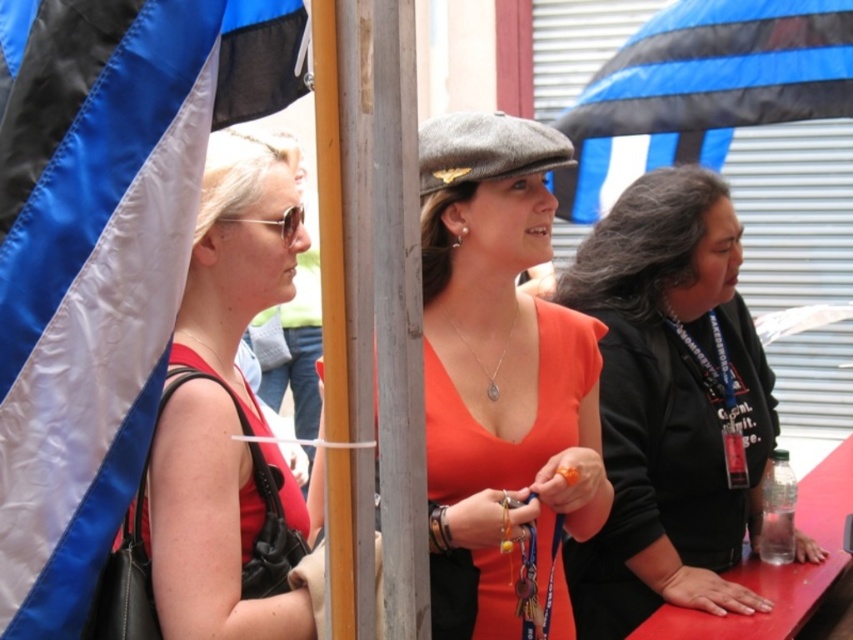
Question: Can you confirm if gray wool beret at center is positioned below silver/chain necklace at center?

Choices:
 (A) yes
 (B) no

Answer: (B)

Question: Among these objects, which one is nearest to the camera?

Choices:
 (A) orange matte dress at center
 (B) gray wool beret at center
 (C) orange matte shirt at center
 (D) blue striped fabric at upper center

Answer: (A)

Question: Estimate the real-world distances between objects in this image. Which object is farther from the gray wool beret at center?

Choices:
 (A) orange matte shirt at center
 (B) orange matte dress at center
 (C) matte black tank top at left
 (D) blue striped fabric at upper center

Answer: (D)

Question: Does orange matte shirt at center come behind gray wool beret at center?

Choices:
 (A) no
 (B) yes

Answer: (B)

Question: Among these points, which one is nearest to the camera?

Choices:
 (A) (677, 253)
 (B) (480, 124)
 (C) (495, 400)

Answer: (B)

Question: From the image, what is the correct spatial relationship of orange matte shirt at center in relation to blue striped fabric at upper center?

Choices:
 (A) left
 (B) right

Answer: (A)